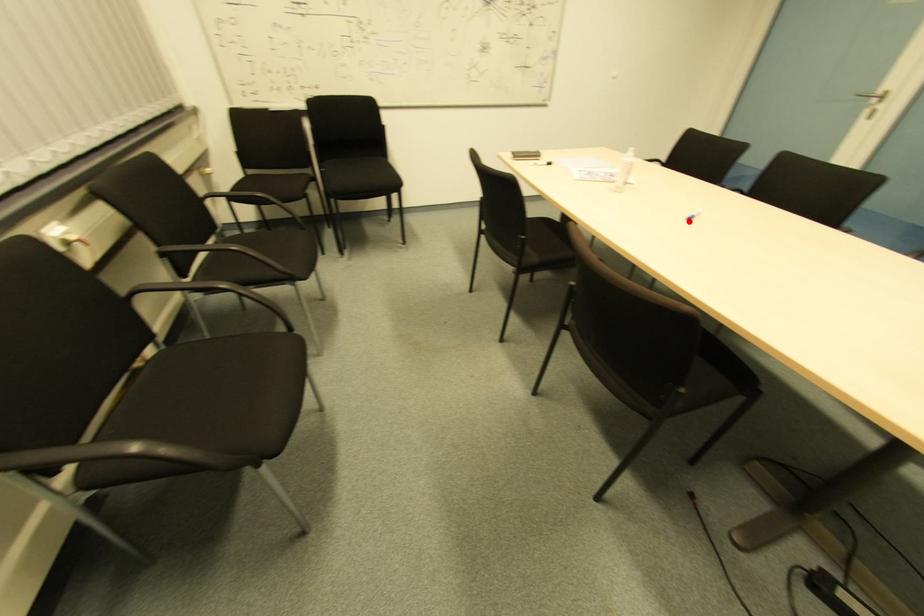
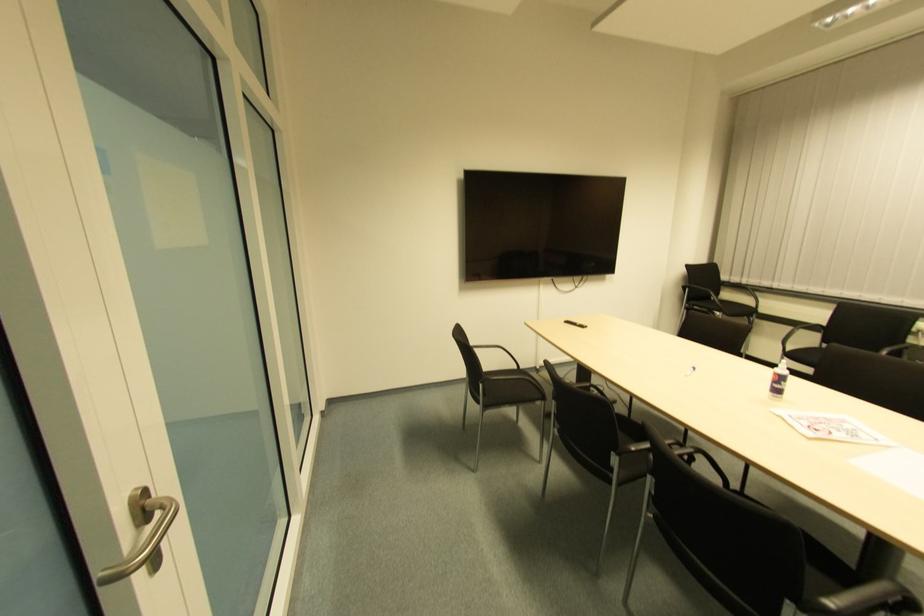
In the second image, find the point that corresponds to the highlighted location in the first image.

(691, 371)